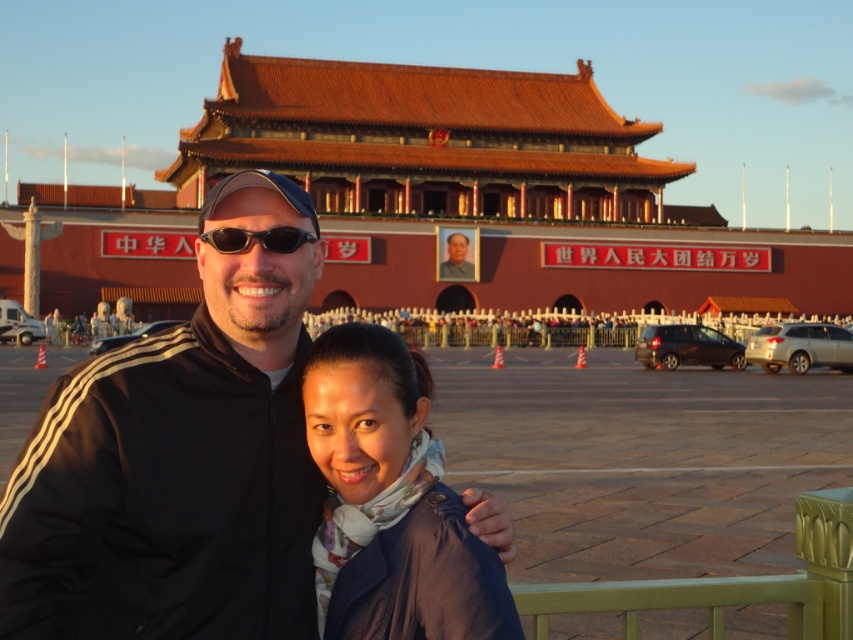
Consider the image. You are a photographer standing at the entrance of Tiananmen Square. You want to take a photo of the blue fabric scarf at center and the smooth skin portrait at center. The camera you are using has a maximum focus range of 70 meters. Will both objects be in focus?

The distance between the blue fabric scarf at center and the smooth skin portrait at center is 75.08 meters. Since the camera can only focus up to 70 meters, the objects will be out of focus.

You are a photographer standing in front of the Tiananmen Gate. You notice two subjects in your frame, the blue fabric scarf at center and the smooth skin portrait at center. Which object is located lower in the image?

The blue fabric scarf at center is positioned under the smooth skin portrait at center, so it is located lower in the image.

You are standing at the point with coordinates point (x=119, y=308) and want to walk to the point with coordinates point (x=662, y=262). According to the scene, will you need to walk towards the foreground or background of the image?

You need to walk towards the background of the image because point (x=662, y=262) is behind point (x=119, y=308).